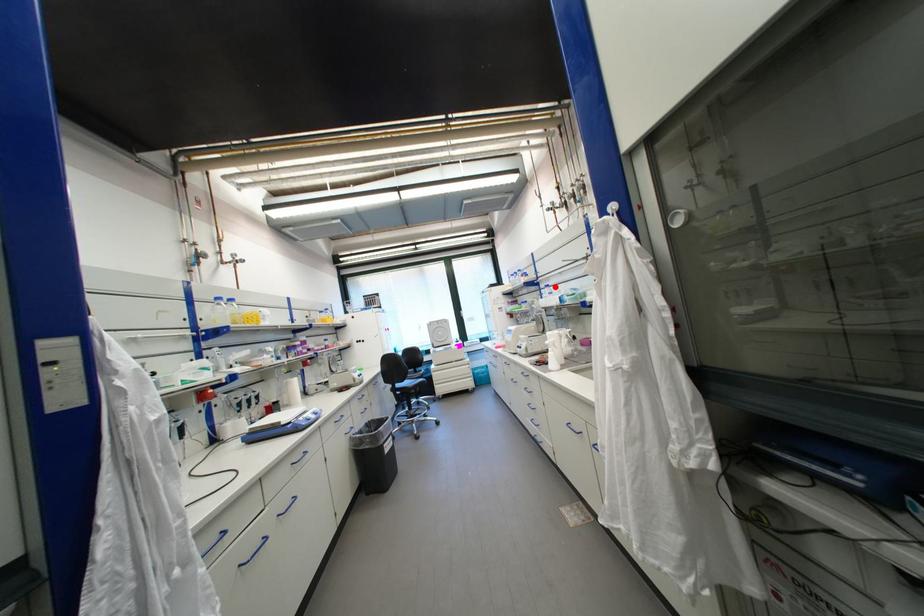
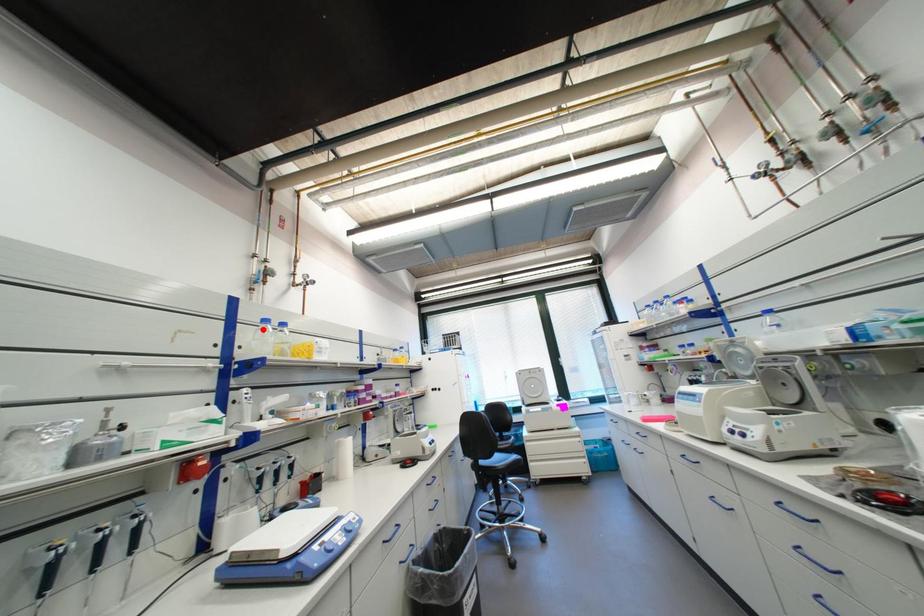
I am providing you with two images of the same scene from different viewpoints. A red point is marked on the first image and another point is marked on the second image. Are the points marked in image1 and image2 representing the same 3D position?

No